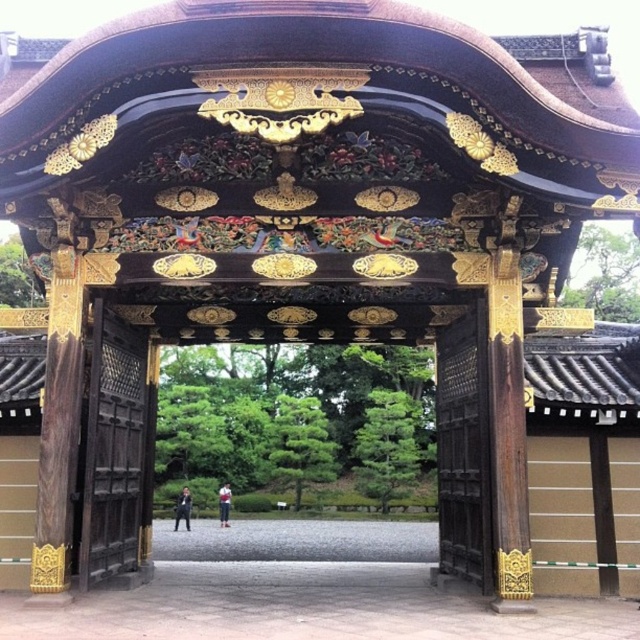
Locate an element on the screen. The width and height of the screenshot is (640, 640). wooden gate at left is located at coordinates (113, 449).

Can you confirm if wooden gate at left is shorter than dark brown wooden gate at right?

In fact, wooden gate at left may be taller than dark brown wooden gate at right.

At what (x,y) coordinates should I click in order to perform the action: click on wooden gate at left. Please return your answer as a coordinate pair (x, y). Looking at the image, I should click on (113, 449).

Identify the location of wooden gate at left. The width and height of the screenshot is (640, 640). (113, 449).

Can you confirm if black wood gate at center is positioned above light blue denim jacket at center?

Yes, black wood gate at center is above light blue denim jacket at center.

Does black wood gate at center come in front of light blue denim jacket at center?

Yes, black wood gate at center is closer to the viewer.

Is point (486, 371) less distant than point (225, 515)?

Yes, point (486, 371) is in front of point (225, 515).

Identify the location of black wood gate at center. (464, 448).

Does wooden gate at left appear over dark suit at center?

Correct, wooden gate at left is located above dark suit at center.

Which is more to the left, wooden gate at left or dark suit at center?

dark suit at center

Describe the element at coordinates (113, 449) in the screenshot. This screenshot has height=640, width=640. I see `wooden gate at left` at that location.

This screenshot has width=640, height=640. I want to click on wooden gate at left, so click(x=113, y=449).